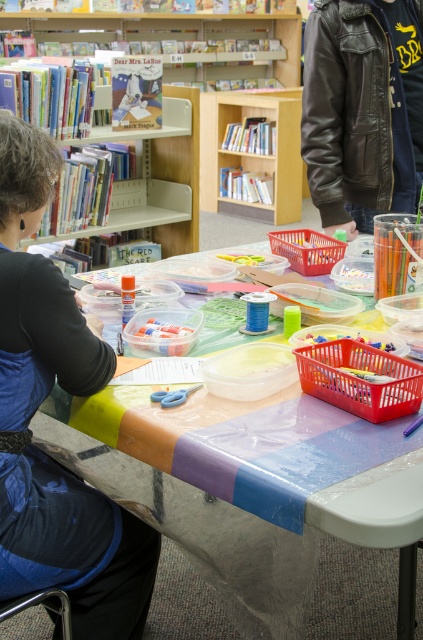
You are standing in front of the table with art supplies and want to pick up two items located at point (211, 419) and point (18, 308). Which item is closer to you?

Point (211, 419) is closer to you because it is further to the viewer than point (18, 308).

You are an artist standing in front of the matte black shirt at left and the light wood bookshelf at upper center. Which object is closer to the ground?

The matte black shirt at left is closer to the ground because it is below the light wood bookshelf at upper center.